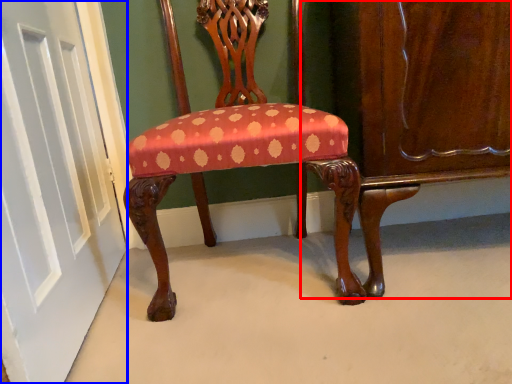
Question: Which object appears farthest to the camera in this image, dresser (highlighted by a red box) or door (highlighted by a blue box)?

Choices:
 (A) dresser
 (B) door

Answer: (A)